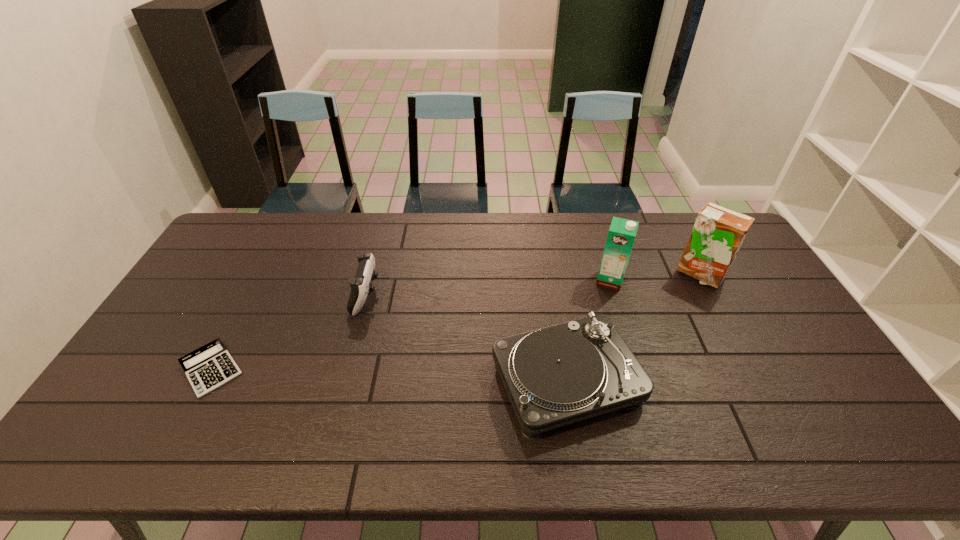
Find the location of a particular element. This screenshot has width=960, height=540. the right carton is located at coordinates (718, 233).

The height and width of the screenshot is (540, 960). I want to click on the left carton, so click(x=622, y=232).

You are a GUI agent. You are given a task and a screenshot of the screen. Output one action in this format:
    pyautogui.click(x=<x>, y=<y>)
    Task: Click on the second object from left to right
    This screenshot has height=540, width=960.
    Given the screenshot: What is the action you would take?
    pyautogui.click(x=361, y=286)

Find the location of a particular element. The width and height of the screenshot is (960, 540). record player is located at coordinates (554, 376).

At what (x,y) coordinates should I click in order to perform the action: click on the leftmost object. Please return your answer as a coordinate pair (x, y). The height and width of the screenshot is (540, 960). Looking at the image, I should click on (210, 366).

Image resolution: width=960 pixels, height=540 pixels. In order to click on the shortest object in this screenshot , I will do `click(210, 366)`.

Locate an element on the screen. This screenshot has height=540, width=960. vacant space located on the straw side of the rightmost object is located at coordinates (723, 319).

You are a GUI agent. You are given a task and a screenshot of the screen. Output one action in this format:
    pyautogui.click(x=<x>, y=<y>)
    Task: Click on the vacant area located on the back of the left carton
    
    Given the screenshot: What is the action you would take?
    pyautogui.click(x=590, y=219)

The image size is (960, 540). I want to click on free space located 0.090m on the front-facing side of the second object from left to right, so [x=407, y=295].

Where is `vacant space located on the right of the record player`? This screenshot has height=540, width=960. vacant space located on the right of the record player is located at coordinates (690, 381).